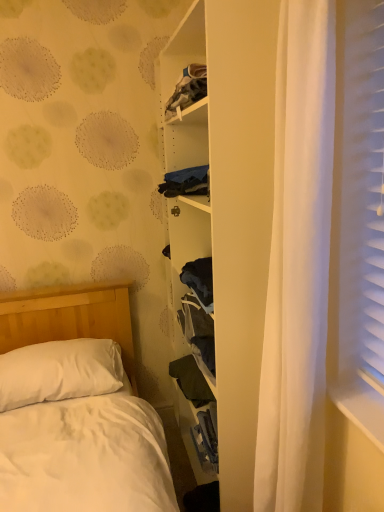
Question: Considering the positions of white matte bookshelf at center and dark green fabric at center in the image, is white matte bookshelf at center taller or shorter than dark green fabric at center?

Choices:
 (A) short
 (B) tall

Answer: (B)

Question: From the image's perspective, relative to dark green fabric at center, is white matte bookshelf at center above or below?

Choices:
 (A) above
 (B) below

Answer: (A)

Question: Based on their relative distances, which object is farther from the white soft pillow at lower left?

Choices:
 (A) dark green fabric at center
 (B) white matte bookshelf at center

Answer: (B)

Question: Considering the real-world distances, which object is farthest from the white matte bookshelf at center?

Choices:
 (A) white soft pillow at lower left
 (B) dark green fabric at center

Answer: (A)